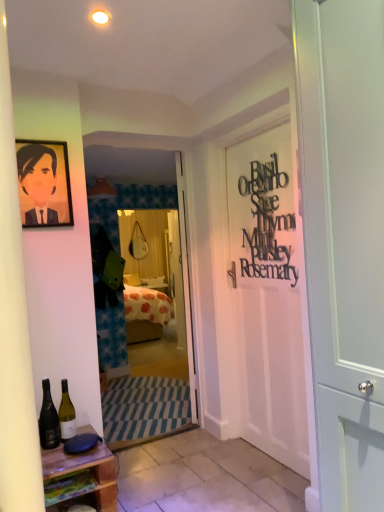
Identify the location of white wooden door at center, the first door positioned from the back. (186, 286).

Find the location of a particular element. This screenshot has width=384, height=512. matte black portrait at upper left is located at coordinates (37, 173).

Describe the element at coordinates (205, 477) in the screenshot. I see `white tile at lower center` at that location.

The image size is (384, 512). What do you see at coordinates (66, 414) in the screenshot?
I see `green glass wine bottle at lower left, arranged as the second bottle when viewed from the left` at bounding box center [66, 414].

Identify the location of green glass wine bottle at lower left, which is the 1th bottle in right-to-left order. The image size is (384, 512). (66, 414).

This screenshot has height=512, width=384. What do you see at coordinates (267, 223) in the screenshot?
I see `black metallic sign at right` at bounding box center [267, 223].

You are a GUI agent. You are given a task and a screenshot of the screen. Output one action in this format:
    pyautogui.click(x=<x>, y=<y>)
    Task: Click on the clear plastic screen door at center
    Image resolution: width=384 pixels, height=512 pixels.
    Given the screenshot: What is the action you would take?
    pyautogui.click(x=142, y=279)

Where is `white matte door at center, acting as the second door starting from the back`? white matte door at center, acting as the second door starting from the back is located at coordinates (344, 239).

Considering the sizes of objects white tile at lower center and white matte door at center, the 1th door when ordered from right to left, in the image provided, who is thinner, white tile at lower center or white matte door at center, the 1th door when ordered from right to left,?

white matte door at center, the 1th door when ordered from right to left, is thinner.

Considering the points (277, 483) and (352, 54), which point is in front, point (277, 483) or point (352, 54)?

The point (352, 54) is closer to the camera.

Looking at this image, which object is positioned more to the right, white tile at lower center or white matte door at center, acting as the second door starting from the back?

From the viewer's perspective, white matte door at center, acting as the second door starting from the back, appears more on the right side.

From a real-world perspective, which door is the 2nd one above the white tile at lower center? Please provide its 2D coordinates.

[(344, 239)]

From the image's perspective, is wooden at lower left under white tile at lower center?

No.

Can you tell me how much wooden at lower left and white tile at lower center differ in facing direction?

The angle between the facing direction of wooden at lower left and the facing direction of white tile at lower center is 1.57 degrees.

Between wooden at lower left and white tile at lower center, which one has less height?

Standing shorter between the two is white tile at lower center.

Which of these two, wooden at lower left or white tile at lower center, is wider?

With larger width is white tile at lower center.

What's the angular difference between dark green glass bottle at lower left, which is the second bottle from right to left, and white matte door at center, the 1th door when ordered from right to left,'s facing directions?

dark green glass bottle at lower left, which is the second bottle from right to left, and white matte door at center, the 1th door when ordered from right to left, are facing 90 degrees away from each other.

Image resolution: width=384 pixels, height=512 pixels. What are the coordinates of `the 2nd bottle to the left of the white matte door at center, the 1th door when ordered from front to back, counting from the anchor's position` in the screenshot? It's located at click(48, 420).

Considering the relative sizes of dark green glass bottle at lower left, which is the 1th bottle from left to right, and white matte door at center, the 1th door when ordered from right to left, in the image provided, is dark green glass bottle at lower left, which is the 1th bottle from left to right, thinner than white matte door at center, the 1th door when ordered from right to left,?

Correct, the width of dark green glass bottle at lower left, which is the 1th bottle from left to right, is less than that of white matte door at center, the 1th door when ordered from right to left.

Considering the relative sizes of dark green glass bottle at lower left, which is the second bottle from right to left, and white matte door at center, the 2th door in the left-to-right sequence, in the image provided, is dark green glass bottle at lower left, which is the second bottle from right to left, bigger than white matte door at center, the 2th door in the left-to-right sequence,?

Actually, dark green glass bottle at lower left, which is the second bottle from right to left, might be smaller than white matte door at center, the 2th door in the left-to-right sequence.

Is black metallic sign at right located within dark green glass bottle at lower left, which is the 1th bottle from left to right?

No, dark green glass bottle at lower left, which is the 1th bottle from left to right, does not contain black metallic sign at right.

How many degrees apart are the facing directions of dark green glass bottle at lower left, which is the 1th bottle from left to right, and black metallic sign at right?

The facing directions of dark green glass bottle at lower left, which is the 1th bottle from left to right, and black metallic sign at right are 91.5 degrees apart.

In the image, is dark green glass bottle at lower left, which is the second bottle from right to left, positioned in front of or behind black metallic sign at right?

In the image, dark green glass bottle at lower left, which is the second bottle from right to left, appears in front of black metallic sign at right.

This screenshot has width=384, height=512. There is a black metallic sign at right. In order to click on the 1st bottle below it (from the image's perspective) in this screenshot , I will do `click(48, 420)`.

From the image's perspective, which object appears higher, black metallic sign at right or white wooden door at center, the first door positioned from the back?

black metallic sign at right.

Is black metallic sign at right positioned far away from white wooden door at center, the first door positioned from the back?

No.

Can we say black metallic sign at right lies outside white wooden door at center, the 2th door positioned from the front?

Yes.

Is white wooden door at center, the second door positioned from the right, at the back of black metallic sign at right?

No, black metallic sign at right's orientation is not away from white wooden door at center, the second door positioned from the right.

Which is behind, point (319, 298) or point (23, 160)?

The point (23, 160) is more distant.

Considering the sizes of objects white matte door at center, the 1th door when ordered from front to back, and matte black portrait at upper left in the image provided, who is shorter, white matte door at center, the 1th door when ordered from front to back, or matte black portrait at upper left?

matte black portrait at upper left.

Is white matte door at center, the 1th door when ordered from right to left, oriented away from matte black portrait at upper left?

No, white matte door at center, the 1th door when ordered from right to left,'s orientation is not away from matte black portrait at upper left.

From a real-world perspective, who is located higher, white matte door at center, acting as the second door starting from the back, or matte black portrait at upper left?

matte black portrait at upper left.

Based on the photo, does white wooden door at center, the first door positioned from the back, have a smaller size compared to black metallic sign at right?

Incorrect, white wooden door at center, the first door positioned from the back, is not smaller in size than black metallic sign at right.

From a real-world perspective, which object stands above the other?

From a 3D spatial view, black metallic sign at right is above.

Is white wooden door at center, the first door positioned from the back, touching black metallic sign at right?

No, white wooden door at center, the first door positioned from the back, is not touching black metallic sign at right.

Can you tell me how much white wooden door at center, which appears as the 1th door when viewed from the left, and black metallic sign at right differ in facing direction?

26 degrees.

Image resolution: width=384 pixels, height=512 pixels. What are the coordinates of `tile on the left of white matte door at center, the 1th door when ordered from front to back` in the screenshot? It's located at (205, 477).

Where is `table above the white tile at lower center (from a real-world perspective)`? Image resolution: width=384 pixels, height=512 pixels. table above the white tile at lower center (from a real-world perspective) is located at coordinates (80, 478).

Looking at the image, which one is located further to white wooden door at center, which appears as the 1th door when viewed from the left, clear plastic screen door at center or white tile at lower center?

clear plastic screen door at center.

From the image, which object appears to be nearer to wooden at lower left, white tile at lower center or clear plastic screen door at center?

white tile at lower center is positioned closer to the anchor wooden at lower left.

Looking at the image, which one is located further to clear plastic screen door at center, white wooden door at center, the second door positioned from the right, or dark green glass bottle at lower left, which is the second bottle from right to left?

Based on the image, dark green glass bottle at lower left, which is the second bottle from right to left, appears to be further to clear plastic screen door at center.

Estimate the real-world distances between objects in this image. Which object is closer to black metallic sign at right, white tile at lower center or matte black portrait at upper left?

matte black portrait at upper left is closer to black metallic sign at right.

In the scene shown: Based on their spatial positions, is black metallic sign at right or green glass wine bottle at lower left, which is the 1th bottle in right-to-left order, closer to matte black portrait at upper left?

green glass wine bottle at lower left, which is the 1th bottle in right-to-left order.

Considering their positions, is black metallic sign at right positioned closer to white wooden door at center, the first door positioned from the back, than green glass wine bottle at lower left, which is the 1th bottle in right-to-left order?

black metallic sign at right is closer to white wooden door at center, the first door positioned from the back.

From the image, which object appears to be farther from matte black portrait at upper left, green glass wine bottle at lower left, which is the 1th bottle in right-to-left order, or dark green glass bottle at lower left, which is the 1th bottle from left to right?

green glass wine bottle at lower left, which is the 1th bottle in right-to-left order, is further to matte black portrait at upper left.

Based on their spatial positions, is dark green glass bottle at lower left, which is the 1th bottle from left to right, or white wooden door at center, which appears as the 1th door when viewed from the left, further from clear plastic screen door at center?

dark green glass bottle at lower left, which is the 1th bottle from left to right, is positioned further to the anchor clear plastic screen door at center.

Locate an element on the screen. The width and height of the screenshot is (384, 512). writing between white matte door at center, acting as the second door starting from the back, and clear plastic screen door at center from front to back is located at coordinates (267, 223).

Locate an element on the screen. The image size is (384, 512). screen door between black metallic sign at right and white tile at lower center from top to bottom is located at coordinates (142, 279).

I want to click on door located between matte black portrait at upper left and black metallic sign at right in the left-right direction, so click(186, 286).

The image size is (384, 512). Identify the location of screen door between green glass wine bottle at lower left, which is the 1th bottle in right-to-left order, and white wooden door at center, which appears as the 1th door when viewed from the left, in the front-back direction. (142, 279).